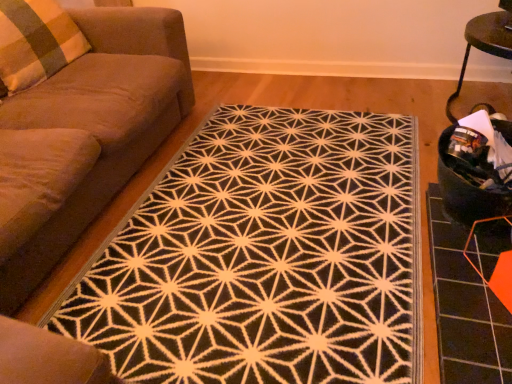
Question: From a real-world perspective, is suede-like brown couch at left positioned under plaid fabric pillow at left based on gravity?

Choices:
 (A) no
 (B) yes

Answer: (B)

Question: Does suede-like brown couch at left appear on the right side of plaid fabric pillow at left?

Choices:
 (A) yes
 (B) no

Answer: (A)

Question: Is suede-like brown couch at left not within plaid fabric pillow at left?

Choices:
 (A) yes
 (B) no

Answer: (A)

Question: Is suede-like brown couch at left in contact with plaid fabric pillow at left?

Choices:
 (A) yes
 (B) no

Answer: (B)

Question: Considering the relative positions of suede-like brown couch at left and plaid fabric pillow at left in the image provided, is suede-like brown couch at left to the left of plaid fabric pillow at left from the viewer's perspective?

Choices:
 (A) no
 (B) yes

Answer: (A)

Question: Would you say black fabric swivel chair at right is to the left or to the right of plaid fabric pillow at left in the picture?

Choices:
 (A) left
 (B) right

Answer: (B)

Question: Choose the correct answer: Is black fabric swivel chair at right inside plaid fabric pillow at left or outside it?

Choices:
 (A) outside
 (B) inside

Answer: (A)

Question: Considering their positions, is black fabric swivel chair at right located in front of or behind plaid fabric pillow at left?

Choices:
 (A) behind
 (B) front

Answer: (B)

Question: Is point (464, 140) positioned closer to the camera than point (46, 41)?

Choices:
 (A) farther
 (B) closer

Answer: (B)

Question: Is black textured rug at center in front of or behind black fabric swivel chair at right in the image?

Choices:
 (A) front
 (B) behind

Answer: (A)

Question: Choose the correct answer: Is black textured rug at center inside black fabric swivel chair at right or outside it?

Choices:
 (A) outside
 (B) inside

Answer: (A)

Question: Based on their sizes in the image, would you say black textured rug at center is bigger or smaller than black fabric swivel chair at right?

Choices:
 (A) small
 (B) big

Answer: (B)

Question: Is black textured rug at center taller or shorter than black fabric swivel chair at right?

Choices:
 (A) short
 (B) tall

Answer: (A)

Question: Visually, is black fabric swivel chair at right positioned to the left or to the right of suede-like brown couch at left?

Choices:
 (A) right
 (B) left

Answer: (A)

Question: Looking at the image, does black fabric swivel chair at right seem bigger or smaller compared to suede-like brown couch at left?

Choices:
 (A) big
 (B) small

Answer: (B)